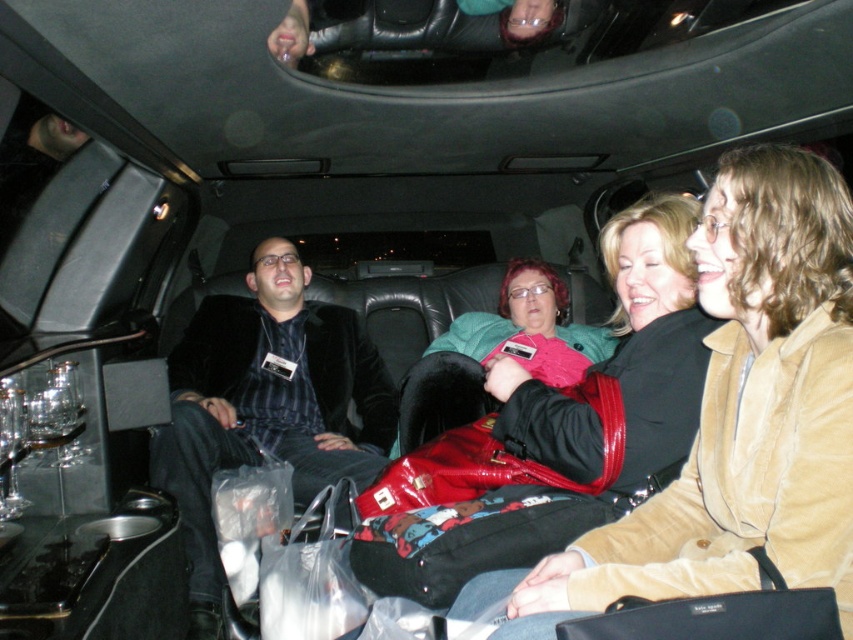
Question: Can you confirm if velvet brown jacket at center is positioned to the left of shiny red purse at center?

Choices:
 (A) no
 (B) yes

Answer: (A)

Question: Which object is the closest to the velvet brown jacket at center?

Choices:
 (A) velvet black jacket at center
 (B) shiny red purse at center

Answer: (B)

Question: Which point appears closest to the camera in this image?

Choices:
 (A) (563, 477)
 (B) (764, 429)

Answer: (B)

Question: Does velvet brown jacket at center appear over velvet black jacket at center?

Choices:
 (A) no
 (B) yes

Answer: (B)

Question: Which object is the farthest from the shiny red purse at center?

Choices:
 (A) velvet black jacket at center
 (B) velvet brown jacket at center

Answer: (A)

Question: Does velvet brown jacket at center appear over velvet black jacket at center?

Choices:
 (A) no
 (B) yes

Answer: (B)